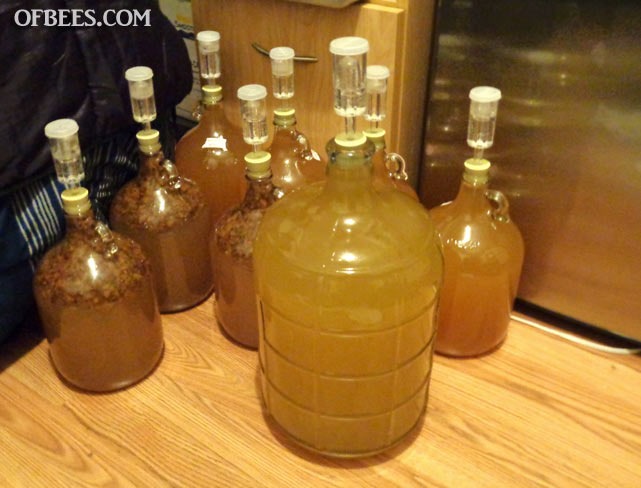
You are a GUI agent. You are given a task and a screenshot of the screen. Output one action in this format:
    pyautogui.click(x=<x>, y=<y>)
    Task: Click on the bottle
    This screenshot has height=488, width=641.
    Given the screenshot: What is the action you would take?
    pyautogui.click(x=187, y=266)